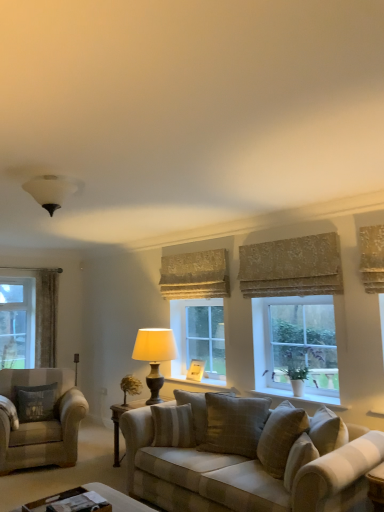
Question: From a real-world perspective, is dark gray fabric pillow at left, which appears as the third pillow when viewed from the right, located higher than wooden coffee table at lower center?

Choices:
 (A) yes
 (B) no

Answer: (A)

Question: Does dark gray fabric pillow at left, which appears as the first pillow when viewed from the back, turn towards wooden coffee table at lower center?

Choices:
 (A) yes
 (B) no

Answer: (A)

Question: Is the depth of dark gray fabric pillow at left, which appears as the first pillow when viewed from the back, greater than that of wooden coffee table at lower center?

Choices:
 (A) yes
 (B) no

Answer: (A)

Question: Can you confirm if dark gray fabric pillow at left, which appears as the third pillow when viewed from the right, is shorter than wooden coffee table at lower center?

Choices:
 (A) yes
 (B) no

Answer: (B)

Question: Is dark gray fabric pillow at left, the third pillow positioned from the front, wider than wooden coffee table at lower center?

Choices:
 (A) no
 (B) yes

Answer: (A)

Question: Is velvet curtain at left, the 3th curtain viewed from the front, facing towards beige textured pillow at center, acting as the 2th pillow starting from the left?

Choices:
 (A) yes
 (B) no

Answer: (A)

Question: Is velvet curtain at left, the 3th curtain viewed from the front, beside beige textured pillow at center, the 2th pillow viewed from the front?

Choices:
 (A) no
 (B) yes

Answer: (A)

Question: Are velvet curtain at left, the 3th curtain viewed from the front, and beige textured pillow at center, acting as the 2th pillow starting from the left, far apart?

Choices:
 (A) yes
 (B) no

Answer: (A)

Question: Is beige textured pillow at center, the 2th pillow viewed from the front, at the back of velvet curtain at left, the 3th curtain viewed from the front?

Choices:
 (A) yes
 (B) no

Answer: (B)

Question: Is the position of velvet curtain at left, the 3th curtain viewed from the front, more distant than that of beige textured pillow at center, which ranks as the 2th pillow in back-to-front order?

Choices:
 (A) yes
 (B) no

Answer: (A)

Question: Is the position of velvet curtain at left, placed as the third curtain when sorted from right to left, less distant than that of beige textured pillow at center, the 2th pillow viewed from the front?

Choices:
 (A) no
 (B) yes

Answer: (A)

Question: From the image's perspective, does matte beige lamp at window, which appears as the first lamp when viewed from the right, appear lower than wooden at center?

Choices:
 (A) no
 (B) yes

Answer: (A)